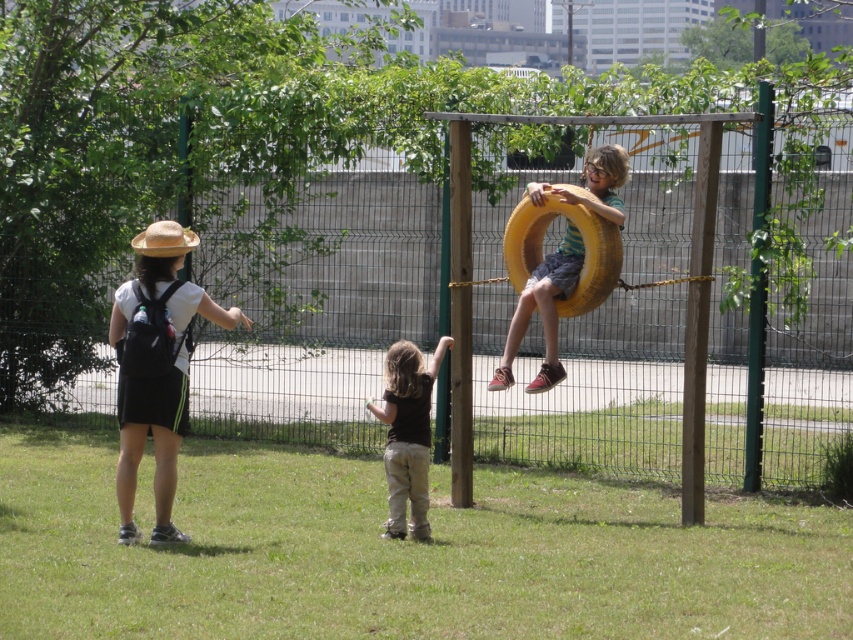
Question: Based on their relative distances, which object is farther from the yellow rubber tire at center?

Choices:
 (A) straw hat at left
 (B) brown cotton shirt at center

Answer: (A)

Question: Which point appears farthest from the camera in this image?

Choices:
 (A) (119, 330)
 (B) (509, 344)
 (C) (401, 400)

Answer: (B)

Question: Does straw hat at left have a smaller size compared to brown cotton shirt at center?

Choices:
 (A) yes
 (B) no

Answer: (B)

Question: Which object is the farthest from the straw hat at left?

Choices:
 (A) yellow rubber tire at center
 (B) brown cotton shirt at center

Answer: (A)

Question: Where is yellow rubber tire at center located in relation to brown cotton shirt at center in the image?

Choices:
 (A) left
 (B) right

Answer: (B)

Question: Where is straw hat at left located in relation to brown cotton shirt at center in the image?

Choices:
 (A) left
 (B) right

Answer: (A)